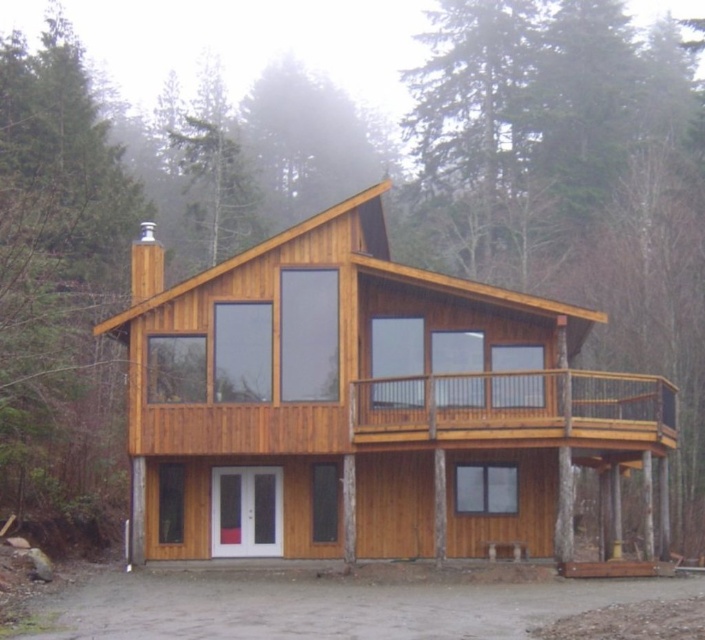
Does natural wood log cabin at center have a lesser width compared to gray concrete driveway at lower center?

No, natural wood log cabin at center is not thinner than gray concrete driveway at lower center.

Locate an element on the screen. This screenshot has width=705, height=640. natural wood log cabin at center is located at coordinates (369, 406).

Where is `natural wood log cabin at center`? The height and width of the screenshot is (640, 705). natural wood log cabin at center is located at coordinates (369, 406).

Who is more forward, (415, 609) or (654, 428)?

Point (415, 609) is more forward.

Does point (348, 632) lie behind point (398, 428)?

No, it is in front of (398, 428).

The height and width of the screenshot is (640, 705). Identify the location of gray concrete driveway at lower center. (329, 605).

Can you confirm if natural wood log cabin at center is positioned to the left of wooden deck at center?

Indeed, natural wood log cabin at center is positioned on the left side of wooden deck at center.

Is natural wood log cabin at center positioned behind wooden deck at center?

No.

Who is more distant from viewer, [484,300] or [556,413]?

The point [484,300] is more distant.

Locate an element on the screen. natural wood log cabin at center is located at coordinates (369, 406).